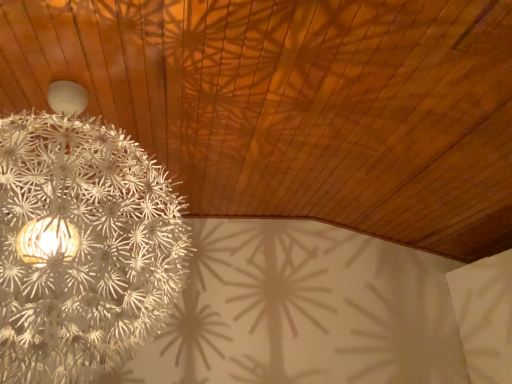
Image resolution: width=512 pixels, height=384 pixels. What do you see at coordinates (82, 244) in the screenshot? I see `white matte spherical lamp at upper left` at bounding box center [82, 244].

Where is `white matte spherical lamp at upper left`? white matte spherical lamp at upper left is located at coordinates (82, 244).

The height and width of the screenshot is (384, 512). Identify the location of white matte spherical lamp at upper left. (82, 244).